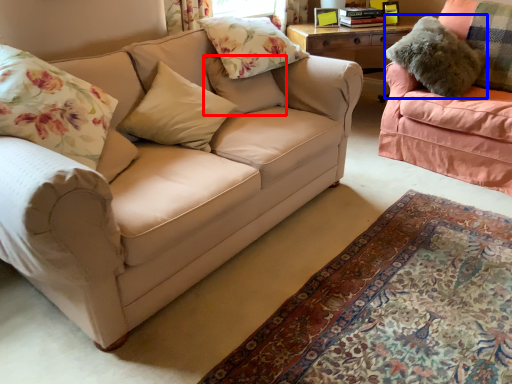
Question: Which object appears farthest to the camera in this image, pillow (highlighted by a red box) or pillow (highlighted by a blue box)?

Choices:
 (A) pillow
 (B) pillow

Answer: (B)